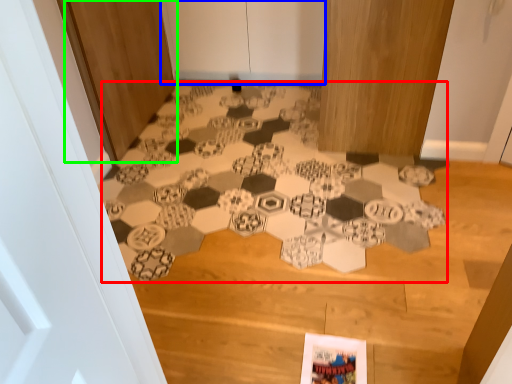
Question: Estimate the real-world distances between objects in this image. Which object is farther from print (highlighted by a red box), door (highlighted by a blue box) or door (highlighted by a green box)?

Choices:
 (A) door
 (B) door

Answer: (A)